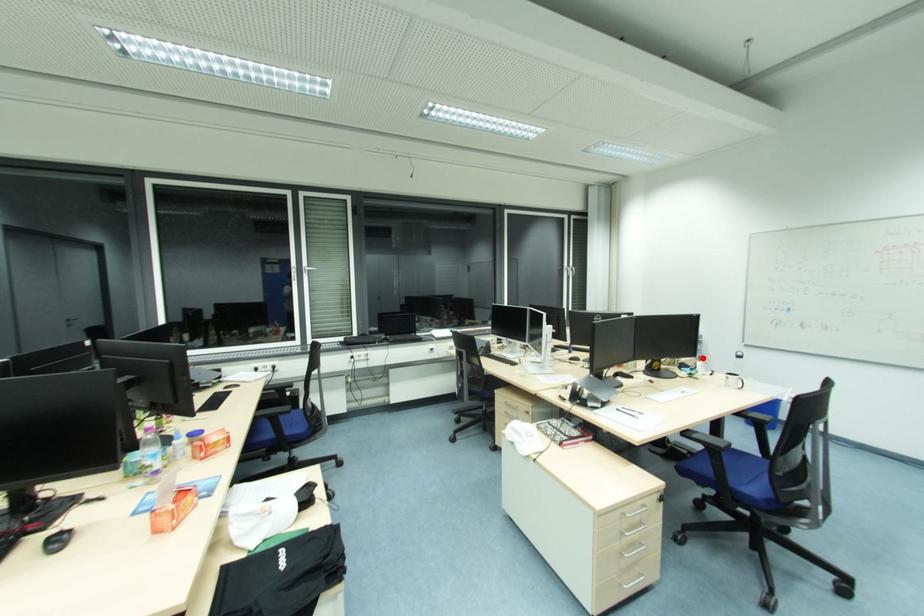
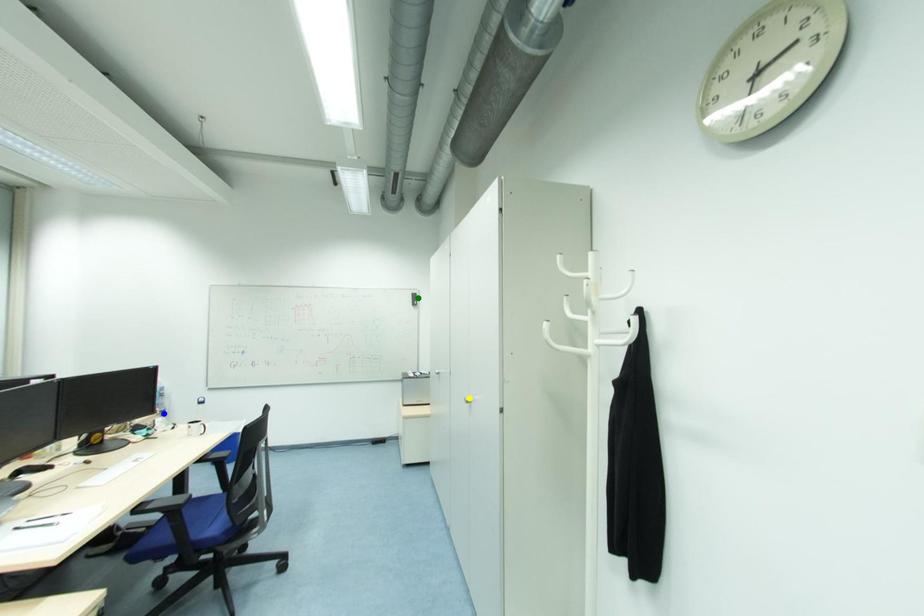
Question: I am providing you with two images of the same scene from different viewpoints. A red point is marked on the first image. You are given multiple points on the second image. Which point in image 2 is actually the same real-world point as the red point in image 1?

Choices:
 (A) green point
 (B) yellow point
 (C) blue point

Answer: (C)